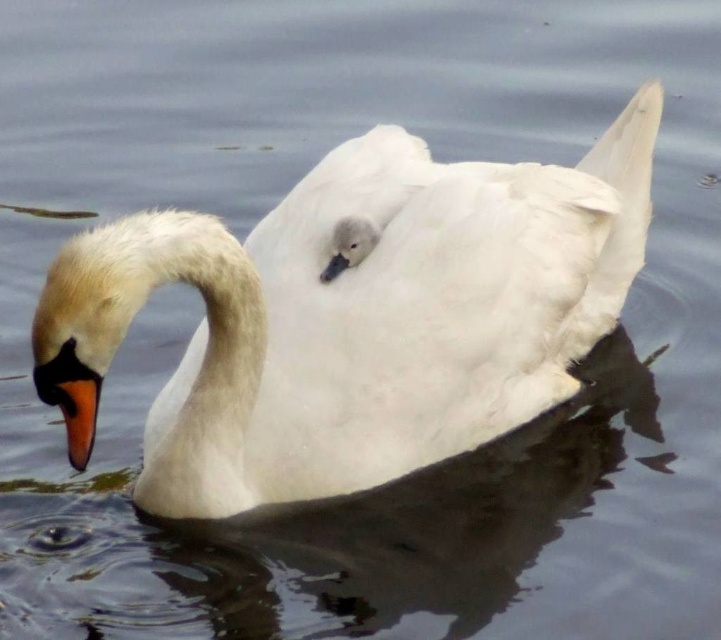
Which is above, white matte swan at center or orange matte beak at lower left?

white matte swan at center is higher up.

In the scene shown: Between white matte swan at center and orange matte beak at lower left, which one has more height?

Standing taller between the two is white matte swan at center.

Measure the distance between white matte swan at center and camera.

white matte swan at center is 7.17 feet from camera.

I want to click on white matte swan at center, so click(x=360, y=314).